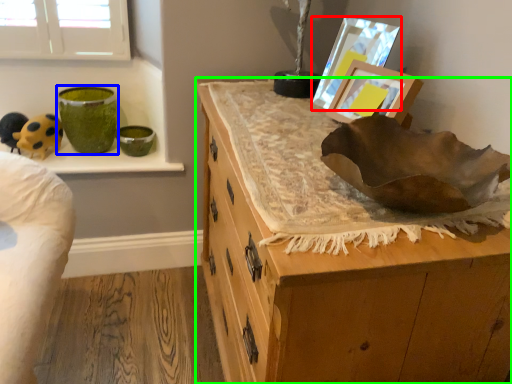
Question: Estimate the real-world distances between objects in this image. Which object is farther from picture frame (highlighted by a red box), glass vase (highlighted by a blue box) or chest of drawers (highlighted by a green box)?

Choices:
 (A) glass vase
 (B) chest of drawers

Answer: (A)